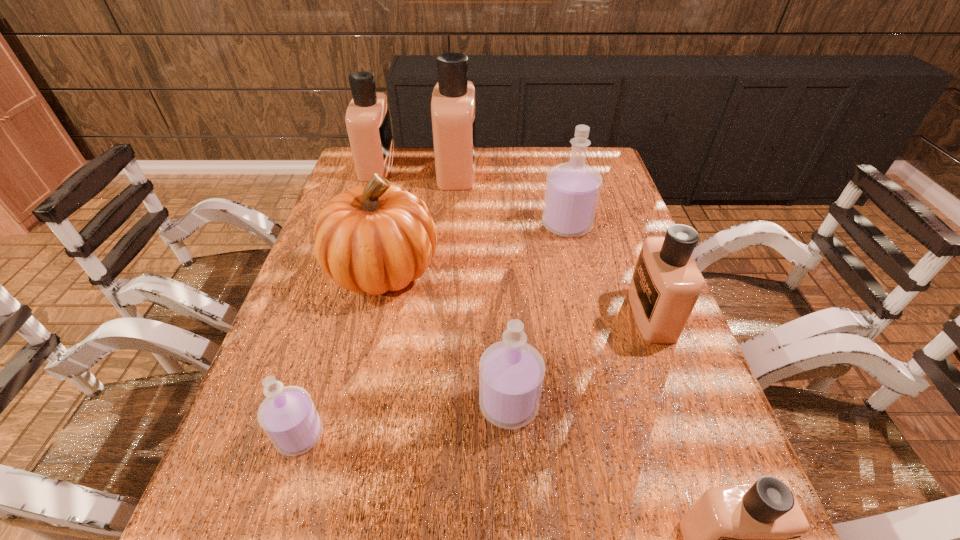
Locate an element on the screen. the smallest purple perfume is located at coordinates (287, 415).

Find the location of a particular element. The image size is (960, 540). free space located 0.380m on the front label of the tallest perfume is located at coordinates (588, 170).

Image resolution: width=960 pixels, height=540 pixels. What are the coordinates of `vacant space located on the front label of the third smallest beige perfume` in the screenshot? It's located at (445, 165).

I want to click on vacant space located 0.290m on the left of the fifth nearest perfume, so click(441, 225).

Identify the location of vacant space located 0.270m on the back of the orange pumpkin. (403, 181).

The width and height of the screenshot is (960, 540). In order to click on vacant space located on the front of the fifth object from left to right in this screenshot , I will do `click(514, 501)`.

At what (x,y) coordinates should I click in order to perform the action: click on vacant space located 0.120m on the front label of the second nearest beige perfume. Please return your answer as a coordinate pair (x, y). Image resolution: width=960 pixels, height=540 pixels. Looking at the image, I should click on coord(581,314).

Find the location of a particular element. vacant point located 0.210m on the front label of the second nearest beige perfume is located at coordinates (542, 314).

Find the location of a particular element. The height and width of the screenshot is (540, 960). vacant space located 0.270m on the front label of the second nearest beige perfume is located at coordinates (516, 314).

Identify the location of free space located 0.330m on the right of the smallest purple perfume. (502, 435).